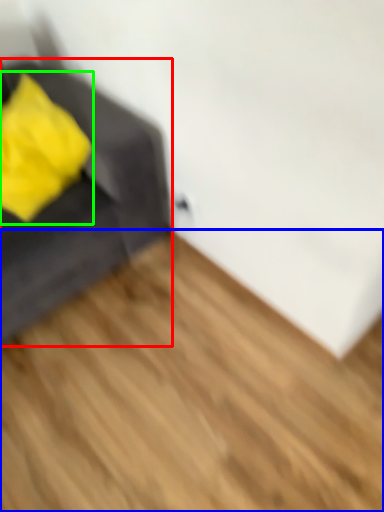
Question: Considering the real-world distances, which object is closest to furniture (highlighted by a red box)? hardwood (highlighted by a blue box) or throw pillow (highlighted by a green box).

Choices:
 (A) hardwood
 (B) throw pillow

Answer: (B)